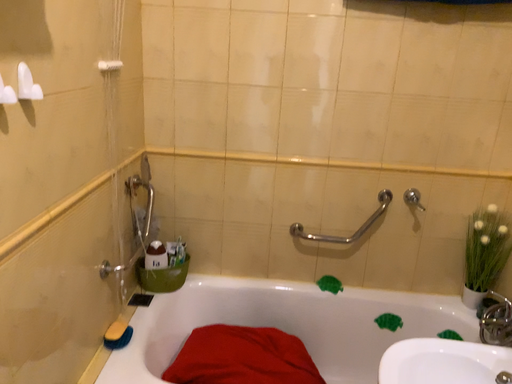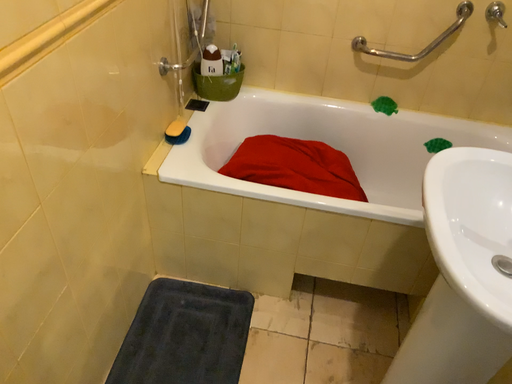
Question: Which way did the camera rotate in the video?

Choices:
 (A) rotated right
 (B) rotated left

Answer: (B)